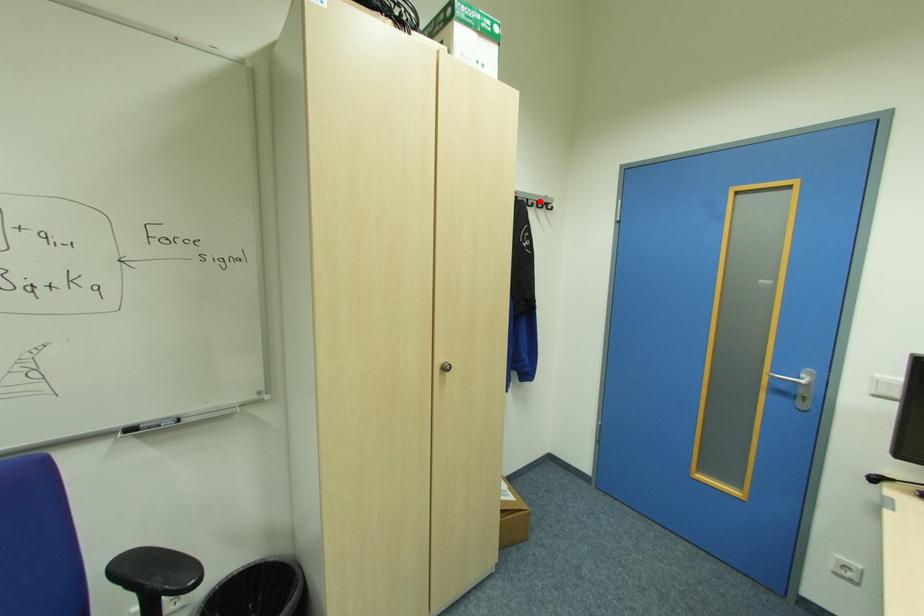
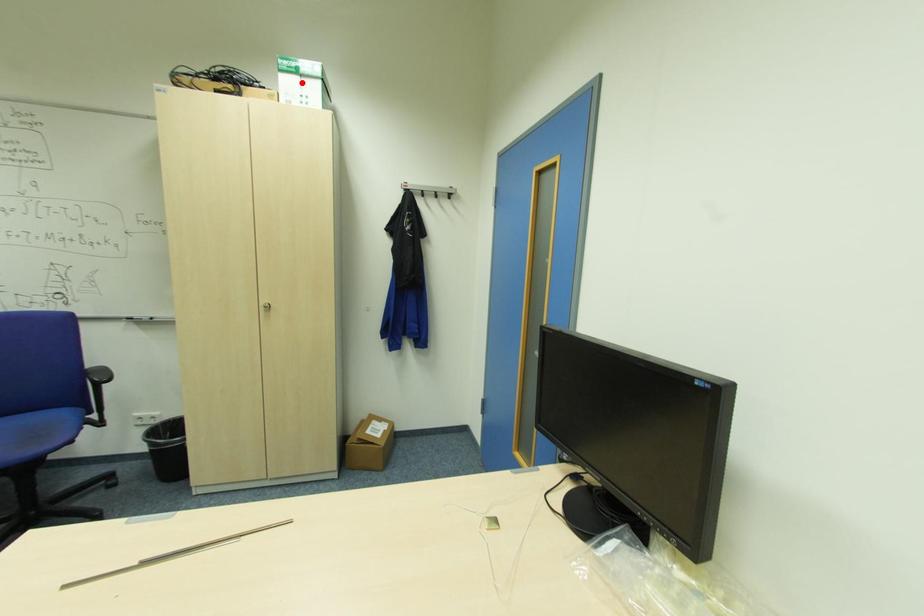
I am providing you with two images of the same scene from different viewpoints. A red point is marked on the first image and another point is marked on the second image. Do the highlighted points in image1 and image2 indicate the same real-world spot?

No